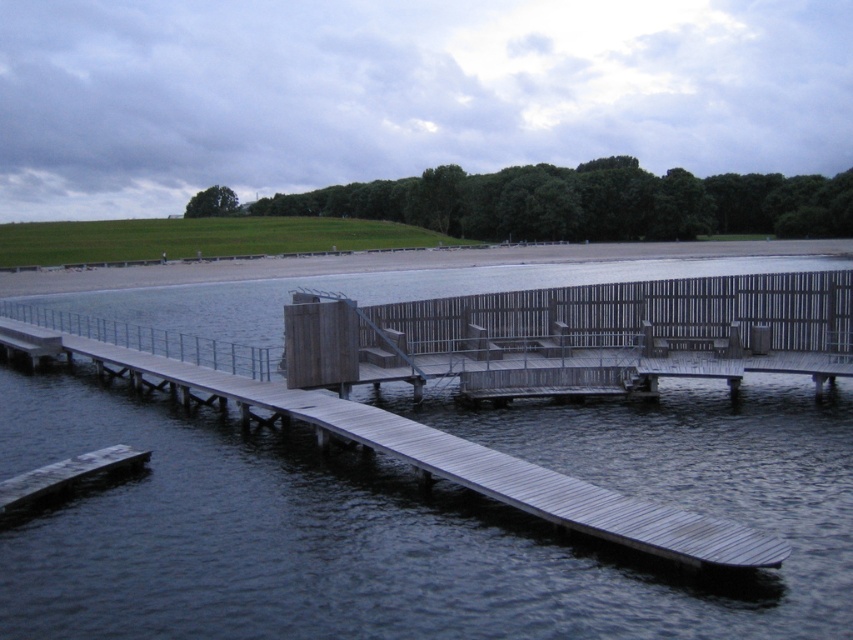
Question: Is wooden dock at center smaller than smooth wooden dock at lower left?

Choices:
 (A) yes
 (B) no

Answer: (B)

Question: Does wooden dock at center have a smaller size compared to smooth wooden dock at lower left?

Choices:
 (A) yes
 (B) no

Answer: (B)

Question: Which point appears farthest from the camera in this image?

Choices:
 (A) (54, 340)
 (B) (132, 461)

Answer: (A)

Question: Where is wooden dock at center located in relation to smooth wooden dock at lower left in the image?

Choices:
 (A) left
 (B) right

Answer: (A)

Question: Which point is farther to the camera?

Choices:
 (A) smooth wooden dock at lower left
 (B) wooden dock at center

Answer: (A)

Question: Which object appears closest to the camera in this image?

Choices:
 (A) wooden dock at center
 (B) smooth wooden dock at lower left

Answer: (A)